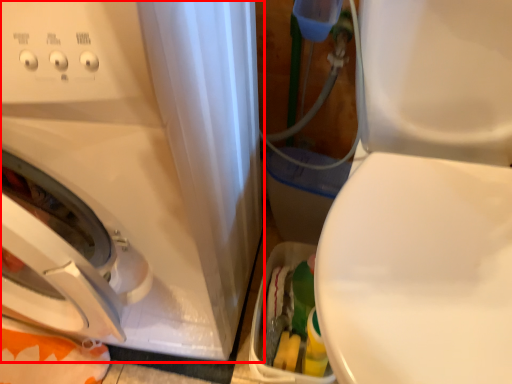
Question: Considering the relative positions of washing machine (annotated by the red box) and machine in the image provided, where is washing machine (annotated by the red box) located with respect to the staircase?

Choices:
 (A) left
 (B) right

Answer: (A)